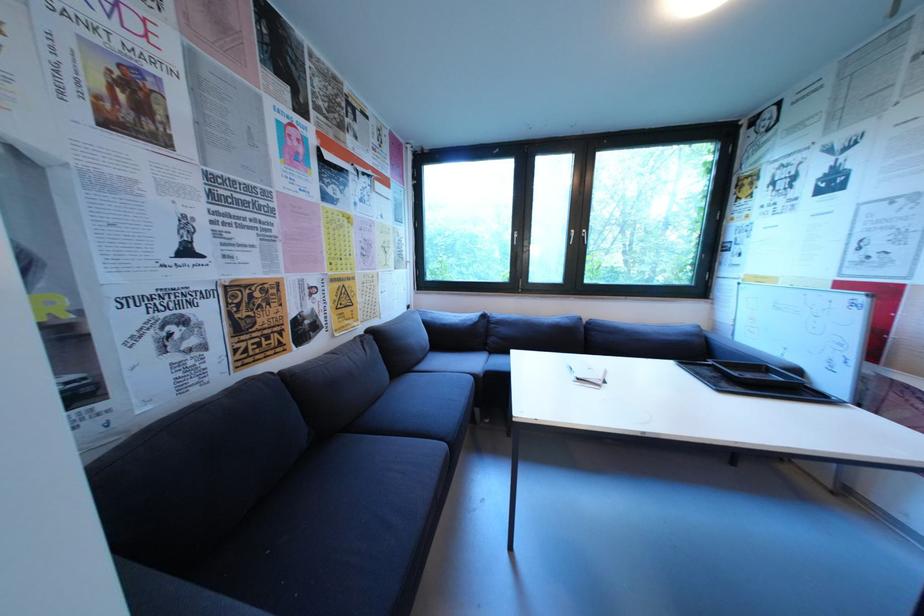
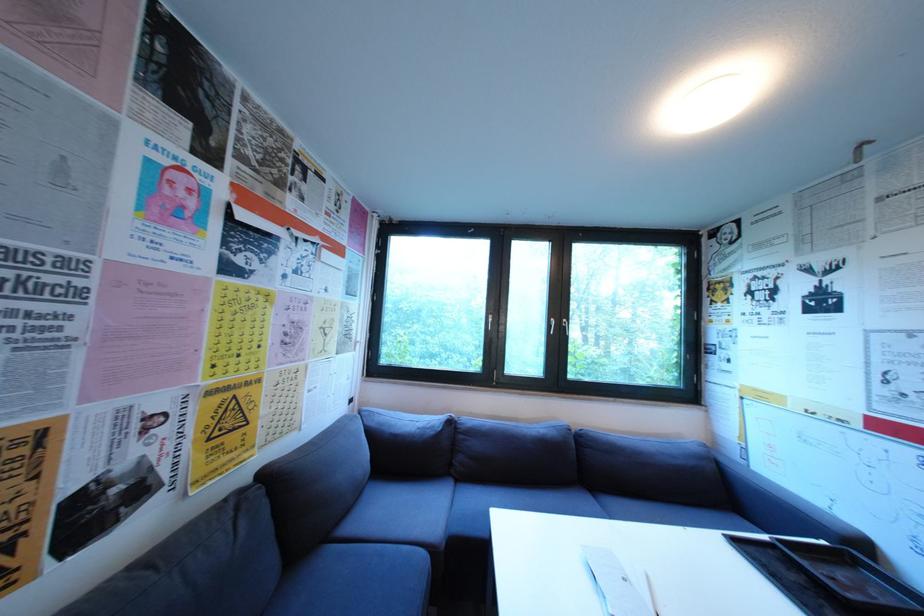
Find the pixel in the second image that matches (464,371) in the first image.

(409, 538)